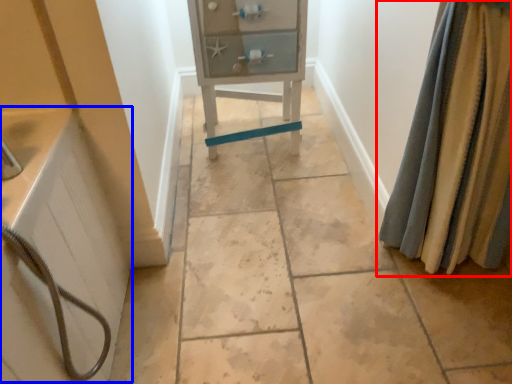
Question: Which object is closer to the camera taking this photo, curtain (highlighted by a red box) or bath (highlighted by a blue box)?

Choices:
 (A) curtain
 (B) bath

Answer: (B)